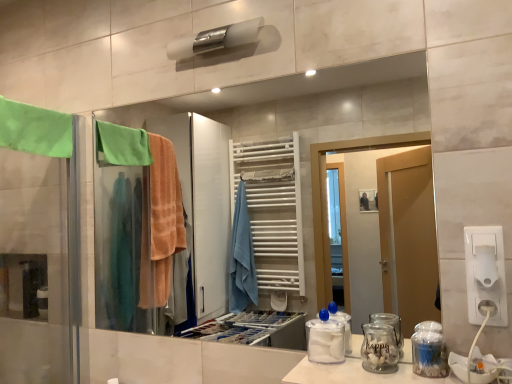
Find the location of `free space in front of transparent plastic container at center`. free space in front of transparent plastic container at center is located at coordinates (341, 372).